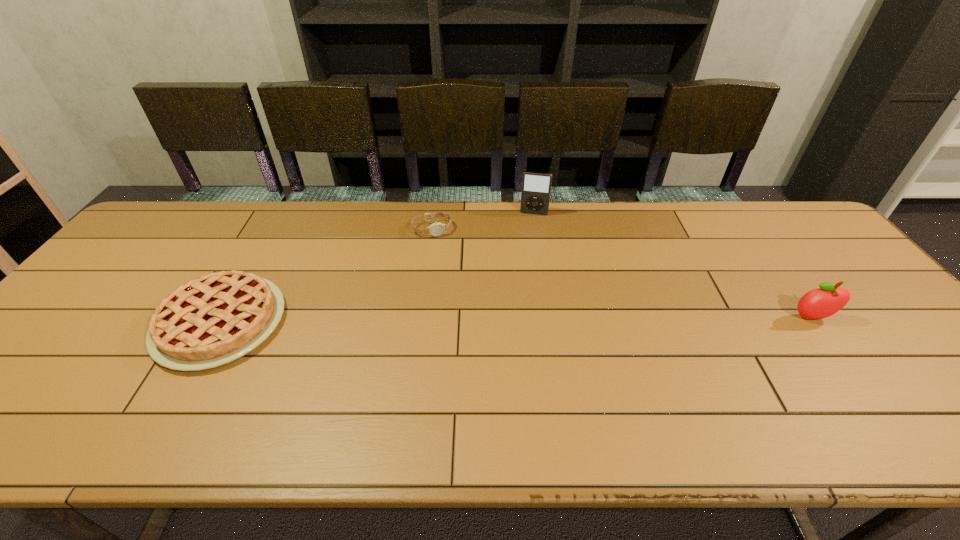
Locate an element on the screen. This screenshot has height=540, width=960. free space on the desktop that is between the pie and the third shortest object and is positioned on the face of the second object from left to right is located at coordinates (465, 320).

Find the location of a particular element. The width and height of the screenshot is (960, 540). vacant space on the desktop that is between the pie and the apple and is positioned on the front-facing side of the iPod is located at coordinates (516, 320).